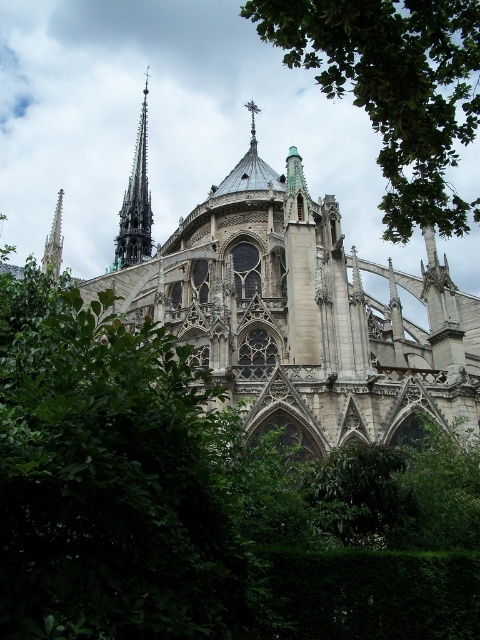
You are a tourist standing at the entrance of the cathedral. You want to take a photo of the smooth stone spire at left and the stone church at center. Which object should you focus on first to ensure both are in frame without moving the camera?

You should focus on the stone church at center first because the smooth stone spire at left is behind it, so by centering the stone church at center in the frame, the smooth stone spire at left will naturally be included in the background without needing to adjust the camera position.

You are a drone operator who needs to fly a drone from the green leafy tree at upper center to the dark gray stone spire at upper left. Given that your drone has a maximum flight range of 90 meters, will it be able to reach the spire without recharging?

The distance between the green leafy tree at upper center and the dark gray stone spire at upper left is 89.28 meters. Since the drone can fly up to 90 meters, it will be able to reach the spire without needing to recharge.